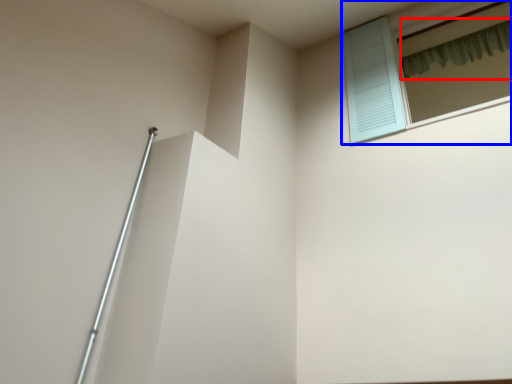
Question: Among these objects, which one is nearest to the camera, shower curtain (highlighted by a red box) or window (highlighted by a blue box)?

Choices:
 (A) shower curtain
 (B) window

Answer: (B)